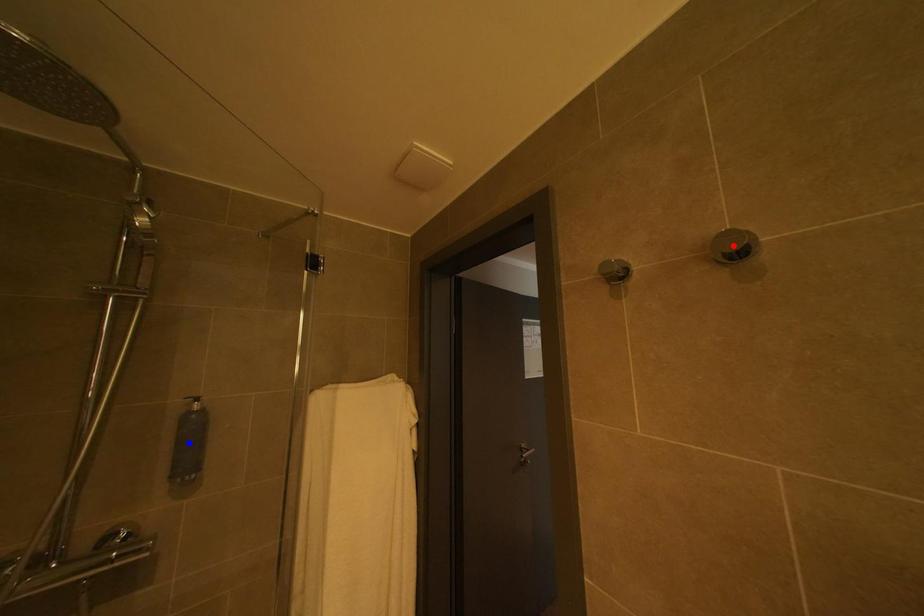
Question: In the image, two points are highlighted. Which point is nearer to the camera? Reply with the corresponding letter.

Choices:
 (A) blue point
 (B) red point

Answer: (B)